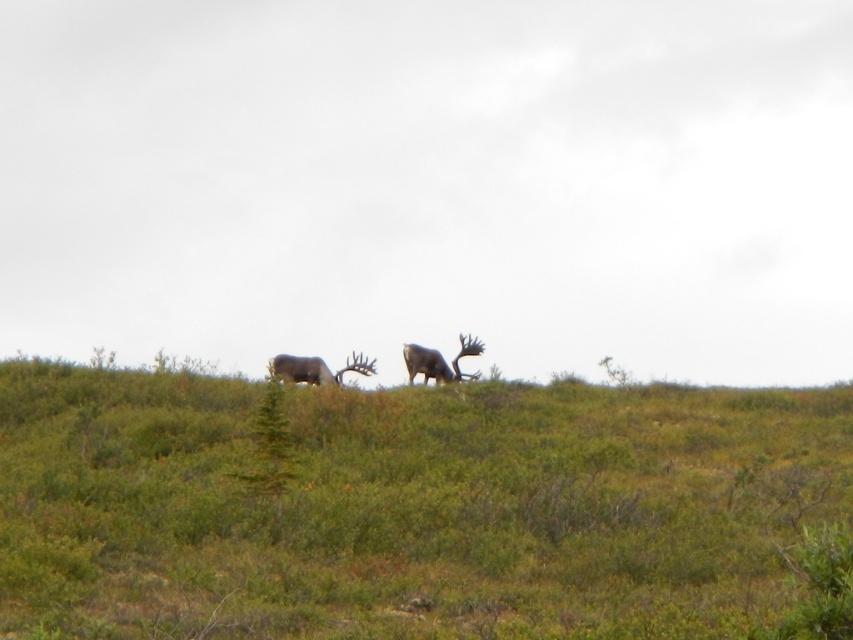
Describe the element at coordinates (407, 508) in the screenshot. This screenshot has width=853, height=640. I see `green grassy hillside at center` at that location.

Can you confirm if green grassy hillside at center is bigger than shiny brown antlered deer at center?

Correct, green grassy hillside at center is larger in size than shiny brown antlered deer at center.

Does point (19, 488) come behind point (442, 376)?

No, it is not.

The image size is (853, 640). In order to click on green grassy hillside at center in this screenshot , I will do `click(407, 508)`.

Can you confirm if green grassy hillside at center is bigger than brown velvet antlered deer at center?

Yes, green grassy hillside at center is bigger than brown velvet antlered deer at center.

Is point (590, 429) farther from camera compared to point (364, 372)?

No, (590, 429) is closer to viewer.

Between point (337, 518) and point (318, 369), which one is positioned behind?

The point (318, 369) is behind.

At what (x,y) coordinates should I click in order to perform the action: click on green grassy hillside at center. Please return your answer as a coordinate pair (x, y). Looking at the image, I should click on (407, 508).

Can you confirm if brown velvet antlered deer at center is thinner than shiny brown antlered deer at center?

Indeed, brown velvet antlered deer at center has a lesser width compared to shiny brown antlered deer at center.

What are the coordinates of `brown velvet antlered deer at center` in the screenshot? It's located at pos(315,369).

At what (x,y) coordinates should I click in order to perform the action: click on brown velvet antlered deer at center. Please return your answer as a coordinate pair (x, y). The width and height of the screenshot is (853, 640). Looking at the image, I should click on (315, 369).